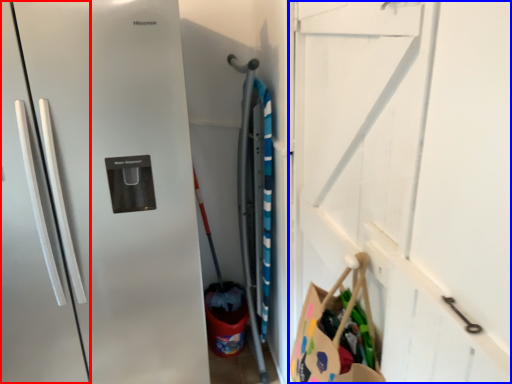
Question: Which object is closer to the camera taking this photo, door (highlighted by a red box) or garage door (highlighted by a blue box)?

Choices:
 (A) door
 (B) garage door

Answer: (A)